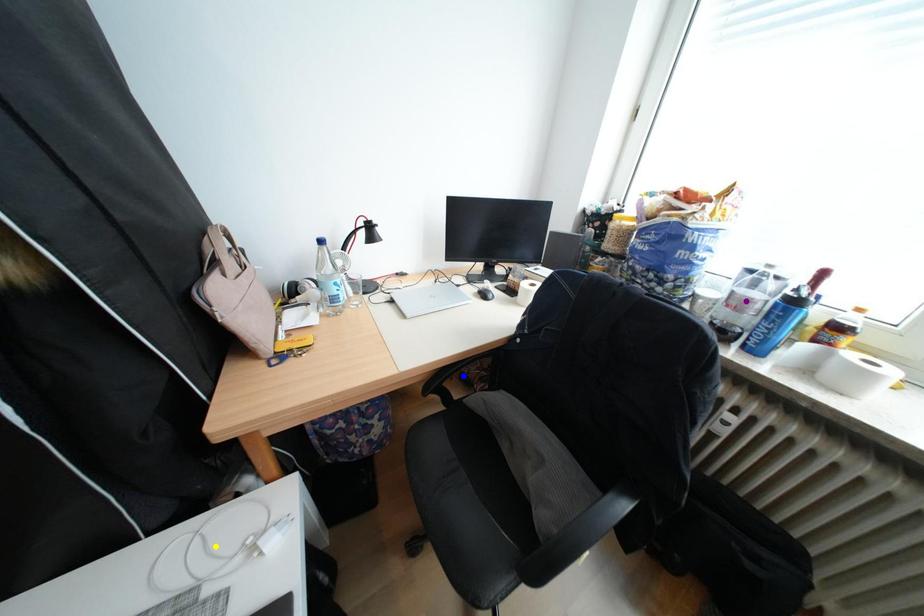
Order these from nearest to farthest:
yellow point, blue point, purple point

yellow point → purple point → blue point